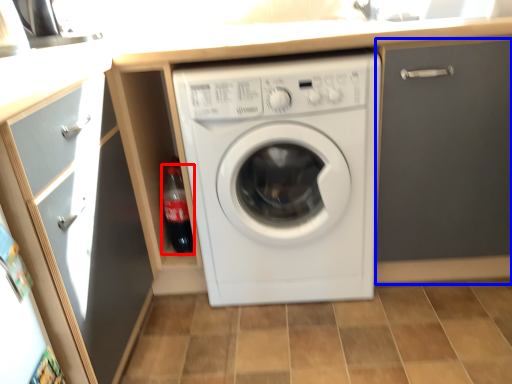
Question: Which point is further to the camera, bottle (highlighted by a red box) or door (highlighted by a blue box)?

Choices:
 (A) bottle
 (B) door

Answer: (A)